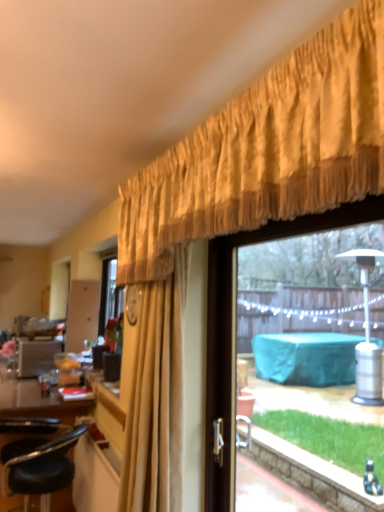
Find the location of a particular element. transparent glass window at upper right is located at coordinates (236, 324).

At what (x,y) coordinates should I click in order to perform the action: click on gold textured curtain at upper center. Please return your answer as a coordinate pair (x, y). This screenshot has height=512, width=384. Looking at the image, I should click on (157, 396).

Describe the element at coordinates (157, 396) in the screenshot. I see `gold textured curtain at upper center` at that location.

This screenshot has height=512, width=384. What are the coordinates of `transparent glass window at upper right` in the screenshot? It's located at (236, 324).

Considering the positions of point (138, 416) and point (33, 449), is point (138, 416) closer or farther from the camera than point (33, 449)?

Point (138, 416) is closer to the camera than point (33, 449).

Can you confirm if gold textured curtain at upper center is thinner than black leather stool at lower left?

Indeed, gold textured curtain at upper center has a lesser width compared to black leather stool at lower left.

Is gold textured curtain at upper center oriented away from black leather stool at lower left?

No, black leather stool at lower left is not at the back of gold textured curtain at upper center.

From the picture: Is black leather stool at lower left aimed at transparent glass window at upper right?

No, black leather stool at lower left is not oriented towards transparent glass window at upper right.

Is black leather stool at lower left wider or thinner than transparent glass window at upper right?

Clearly, black leather stool at lower left has more width compared to transparent glass window at upper right.

From a real-world perspective, is black leather stool at lower left positioned above or below transparent glass window at upper right?

black leather stool at lower left is below transparent glass window at upper right.

Is black leather stool at lower left outside of transparent glass window at upper right?

Yes, black leather stool at lower left is located beyond the bounds of transparent glass window at upper right.

Is transparent glass window at upper right directly adjacent to black leather stool at lower left?

transparent glass window at upper right and black leather stool at lower left are not in contact.

From the image's perspective, is transparent glass window at upper right located above black leather stool at lower left?

Correct, transparent glass window at upper right appears higher than black leather stool at lower left in the image.

Based on the photo, considering the sizes of objects transparent glass window at upper right and black leather stool at lower left in the image provided, who is smaller, transparent glass window at upper right or black leather stool at lower left?

Smaller between the two is transparent glass window at upper right.

Is transparent glass window at upper right closer to the viewer compared to black leather stool at lower left?

Yes, transparent glass window at upper right is in front of black leather stool at lower left.

Find the location of a particular element. The width and height of the screenshot is (384, 512). curtain that appears above the transparent glass window at upper right (from the image's perspective) is located at coordinates (157, 396).

Is transparent glass window at upper right positioned in front of gold textured curtain at upper center?

Yes.

Can you confirm if transparent glass window at upper right is taller than gold textured curtain at upper center?

A: In fact, transparent glass window at upper right may be shorter than gold textured curtain at upper center.

Is transparent glass window at upper right wider or thinner than gold textured curtain at upper center?

Clearly, transparent glass window at upper right has less width compared to gold textured curtain at upper center.

From a real-world perspective, is black leather stool at lower left above or below gold textured curtain at upper center?

Clearly, from a real-world perspective, black leather stool at lower left is below gold textured curtain at upper center.

Which object is positioned more to the right, black leather stool at lower left or gold textured curtain at upper center?

From the viewer's perspective, gold textured curtain at upper center appears more on the right side.

From the image's perspective, is black leather stool at lower left on top of gold textured curtain at upper center?

No.

Can you tell me how much black leather stool at lower left and gold textured curtain at upper center differ in facing direction?

91.2 degrees.

From a real-world perspective, which object rests below the other?

From a 3D spatial view, transparent glass window at upper right is below.

From the image's perspective, is gold textured curtain at upper center located above or below transparent glass window at upper right?

gold textured curtain at upper center is situated higher than transparent glass window at upper right in the image.

Could you measure the distance between gold textured curtain at upper center and transparent glass window at upper right?

A distance of 11.89 inches exists between gold textured curtain at upper center and transparent glass window at upper right.

Is the position of gold textured curtain at upper center less distant than that of transparent glass window at upper right?

No.

Identify the location of curtain above the black leather stool at lower left (from the image's perspective). (157, 396).

This screenshot has width=384, height=512. Find the location of `chair that appears on the left of transparent glass window at upper right`. chair that appears on the left of transparent glass window at upper right is located at coordinates (39, 466).

Looking at the image, which one is located closer to black leather stool at lower left, transparent glass window at upper right or gold textured curtain at upper center?

Among the two, gold textured curtain at upper center is located nearer to black leather stool at lower left.

From the image, which object appears to be nearer to gold textured curtain at upper center, transparent glass window at upper right or black leather stool at lower left?

Among the two, transparent glass window at upper right is located nearer to gold textured curtain at upper center.

From the picture: When comparing their distances from gold textured curtain at upper center, does black leather stool at lower left or transparent glass window at upper right seem closer?

transparent glass window at upper right is closer to gold textured curtain at upper center.

Based on the photo, estimate the real-world distances between objects in this image. Which object is closer to transparent glass window at upper right, black leather stool at lower left or gold textured curtain at upper center?

gold textured curtain at upper center.

Estimate the real-world distances between objects in this image. Which object is closer to black leather stool at lower left, gold textured curtain at upper center or transparent glass window at upper right?

gold textured curtain at upper center is closer to black leather stool at lower left.

From the image, which object appears to be nearer to transparent glass window at upper right, gold textured curtain at upper center or black leather stool at lower left?

gold textured curtain at upper center is closer to transparent glass window at upper right.

Image resolution: width=384 pixels, height=512 pixels. Find the location of `curtain between black leather stool at lower left and transparent glass window at upper right from left to right`. curtain between black leather stool at lower left and transparent glass window at upper right from left to right is located at coordinates (157, 396).